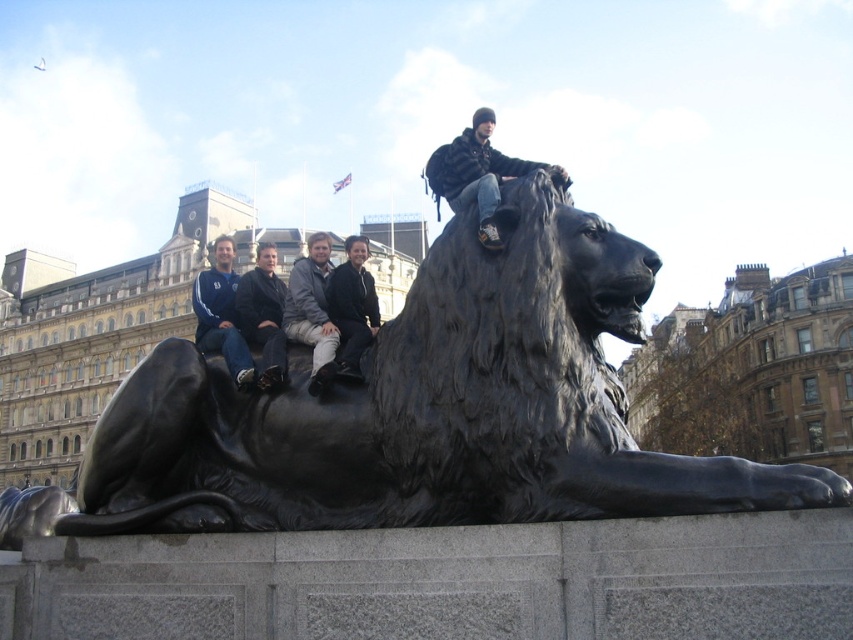
You are a photographer trying to capture a photo of the matte black jacket at upper center and the dark brown leather jacket at center. Based on their positions, which jacket would appear closer to the camera in the photo?

The matte black jacket at upper center appears closer to the camera because it is positioned above the dark brown leather jacket at center, indicating a higher elevation in the image.

You are standing in front of the black polished stone lion at center and the black matte jacket at upper center. Which object is higher in position?

The black matte jacket at upper center is higher than the black polished stone lion at center.

You are a photographer trying to capture a group photo of the matte black jacket at upper center and the dark brown leather jacket at center. Which jacket should you zoom in on to ensure both are equally visible in the frame?

The matte black jacket at upper center is narrower than the dark brown leather jacket at center, so you should zoom in on the dark brown leather jacket at center to ensure both are equally visible in the frame.